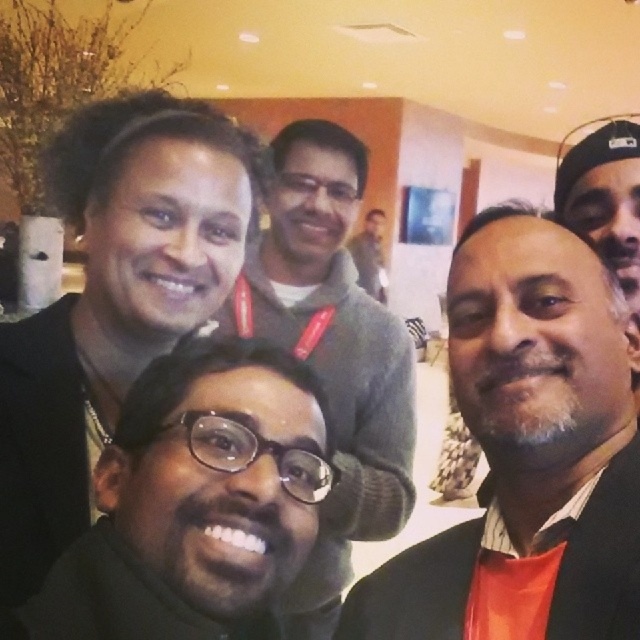
Can you confirm if black matte glasses at center is bigger than matte gray sweater at center?

No, black matte glasses at center is not bigger than matte gray sweater at center.

Describe the element at coordinates (195, 502) in the screenshot. This screenshot has height=640, width=640. I see `black matte glasses at center` at that location.

Is point (90, 632) closer to camera compared to point (259, 291)?

That is True.

Find the location of a particular element. This screenshot has width=640, height=640. black matte glasses at center is located at coordinates (195, 502).

How much distance is there between black matte face at left and black matte glasses at center?

A distance of 12.46 inches exists between black matte face at left and black matte glasses at center.

Based on the photo, is black matte face at left positioned behind black matte glasses at center?

That is True.

Is point (234, 148) positioned after point (168, 570)?

Yes, it is behind point (168, 570).

Find the location of a particular element. black matte face at left is located at coordinates (113, 301).

Who is taller, black matte face at left or matte gray sweater at center?

matte gray sweater at center is taller.

Does point (134, 321) lie behind point (396, 380)?

No, (134, 321) is in front of (396, 380).

The image size is (640, 640). I want to click on black matte face at left, so click(x=113, y=301).